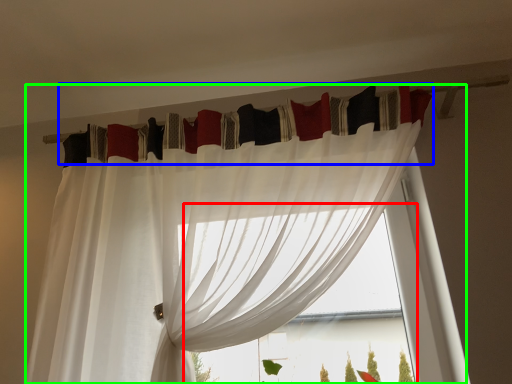
Question: Which object is the closest to the bay window (highlighted by a red box)? Choose among these: curtain (highlighted by a blue box) or curtain (highlighted by a green box).

Choices:
 (A) curtain
 (B) curtain

Answer: (B)